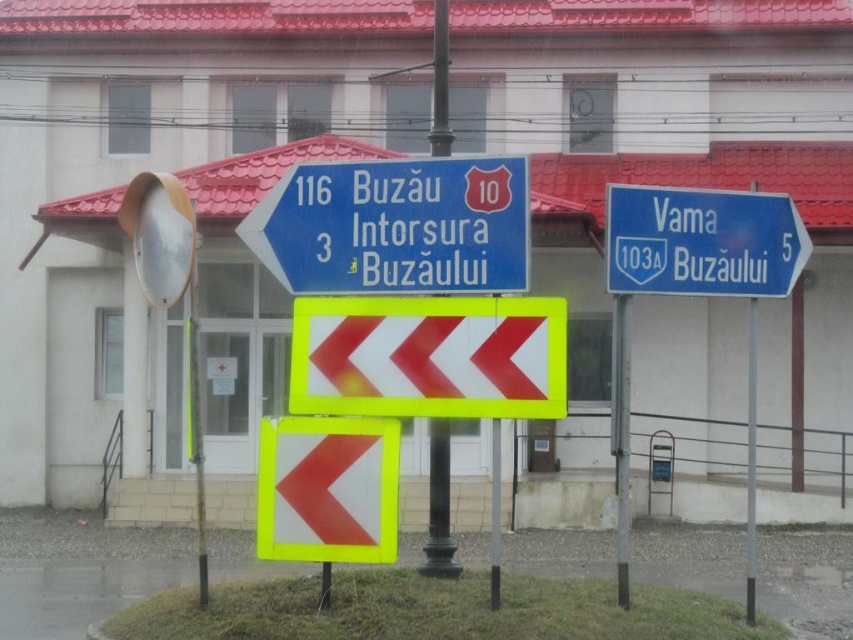
Question: Which point is closer to the camera?

Choices:
 (A) white reflective chevron at center
 (B) blue plastic road sign at upper left

Answer: (A)

Question: Considering the real-world distances, which object is closest to the black metal pole at center?

Choices:
 (A) blue plastic road sign at upper left
 (B) metallic pole at center
 (C) white reflective chevron at center

Answer: (C)

Question: Is blue plastic road sign at upper left to the right of white reflective chevron at center from the viewer's perspective?

Choices:
 (A) no
 (B) yes

Answer: (A)

Question: Is blue plastic road sign at upper left to the left of metallic pole at center from the viewer's perspective?

Choices:
 (A) yes
 (B) no

Answer: (A)

Question: Which point appears closest to the camera in this image?

Choices:
 (A) (344, 532)
 (B) (439, 464)
 (C) (453, 252)
 (D) (300, 337)

Answer: (C)

Question: Is blue plastic road sign at upper left smaller than blue plastic sign at upper right?

Choices:
 (A) yes
 (B) no

Answer: (A)